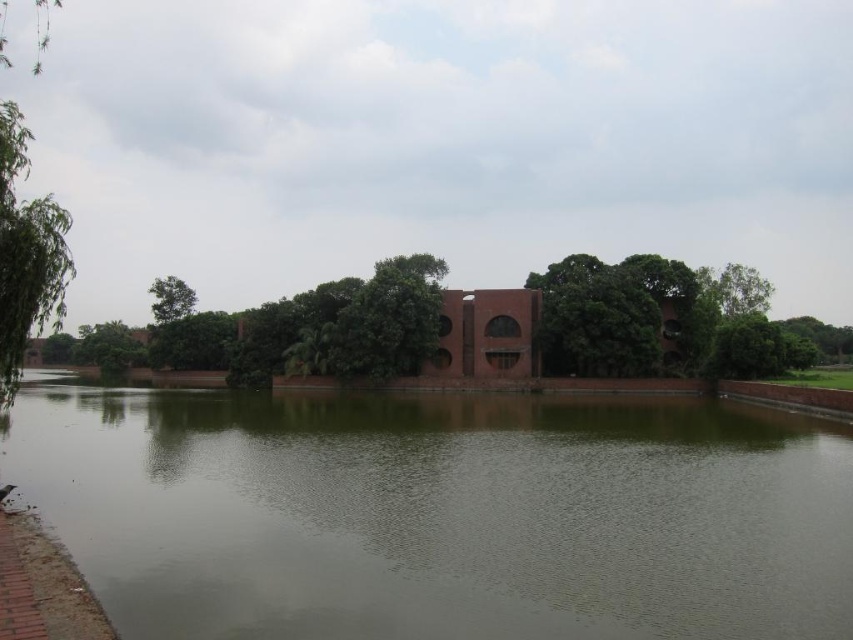
Who is shorter, green leafy tree at left or green leafy tree at upper left?

Standing shorter between the two is green leafy tree at upper left.

Can you confirm if green leafy tree at left is smaller than green leafy tree at upper left?

Incorrect, green leafy tree at left is not smaller in size than green leafy tree at upper left.

Find the location of `green leafy tree at left`. green leafy tree at left is located at coordinates (26, 256).

Consider the image. Who is taller, brown matte lake at center or green leafy tree at upper left?

green leafy tree at upper left is taller.

Which is behind, point (27, 426) or point (167, 298)?

Positioned behind is point (167, 298).

Locate an element on the screen. Image resolution: width=853 pixels, height=640 pixels. brown matte lake at center is located at coordinates (440, 513).

Can you confirm if green leafy tree at center is positioned to the left of green leafy tree at upper left?

Yes, green leafy tree at center is to the left of green leafy tree at upper left.

Is point (123, 356) positioned behind point (196, 300)?

Yes, point (123, 356) is farther from viewer.

This screenshot has height=640, width=853. What are the coordinates of `green leafy tree at center` in the screenshot? It's located at (108, 346).

Identify the location of green leafy tree at center. The height and width of the screenshot is (640, 853). (108, 346).